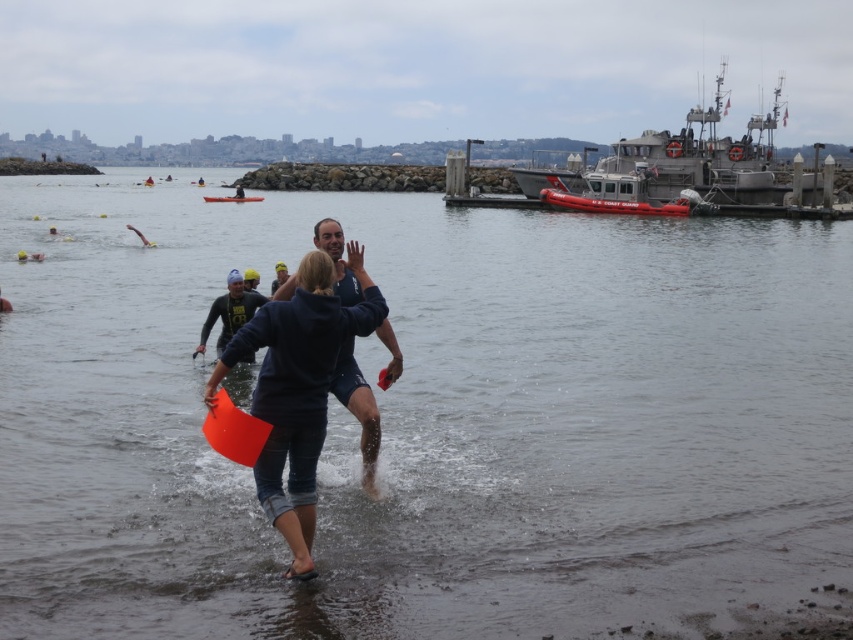
Question: Is dark blue hoodie at center positioned before orange plastic kayak at center?

Choices:
 (A) no
 (B) yes

Answer: (B)

Question: Which point appears farthest from the camera in this image?

Choices:
 (A) (299, 356)
 (B) (341, 300)
 (C) (254, 200)
 (D) (511, 348)

Answer: (C)

Question: Which object is farther from the camera taking this photo?

Choices:
 (A) orange plastic kayak at center
 (B) dark blue fabric at center
 (C) orange foam paddle at lower center

Answer: (A)

Question: Is clear water at center above orange foam paddle at lower center?

Choices:
 (A) no
 (B) yes

Answer: (B)

Question: Is orange foam paddle at lower center positioned before orange plastic kayak at center?

Choices:
 (A) yes
 (B) no

Answer: (A)

Question: Which object is the farthest from the clear water at center?

Choices:
 (A) dark blue fabric at center
 (B) dark blue hoodie at center

Answer: (A)